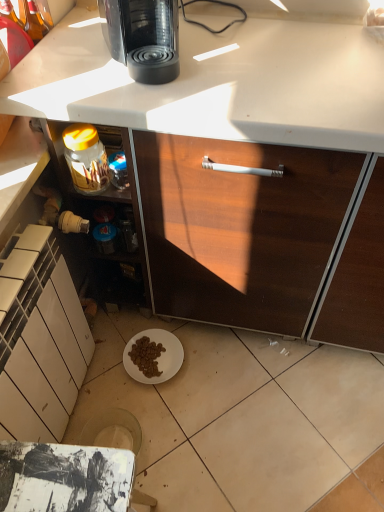
Measure the distance between white matte cabinet at lower left and camera.

white matte cabinet at lower left is 34.69 inches away from camera.

Locate an element on the screen. This screenshot has height=512, width=384. translucent glass jar at lower left is located at coordinates (91, 162).

I want to click on black glossy coffee maker at upper center, so tap(143, 37).

From a real-world perspective, is white matte cabinet at lower left positioned above or below translucent glass jar at lower left?

Clearly, from a real-world perspective, white matte cabinet at lower left is below translucent glass jar at lower left.

Which point is more forward, [39,390] or [49,122]?

The point [49,122] is more forward.

The height and width of the screenshot is (512, 384). Find the location of `shelf that is above the white matte cabinet at lower left (from a real-world perspective)`. shelf that is above the white matte cabinet at lower left (from a real-world perspective) is located at coordinates (91, 162).

From the image's perspective, is white matte cabinet at lower left over translucent glass jar at lower left?

Actually, white matte cabinet at lower left appears below translucent glass jar at lower left in the image.

Considering the positions of point (105, 190) and point (141, 60), is point (105, 190) closer or farther from the camera than point (141, 60)?

Point (105, 190).

Is translucent glass jar at lower left shorter than black glossy coffee maker at upper center?

Incorrect, the height of translucent glass jar at lower left does not fall short of that of black glossy coffee maker at upper center.

Measure the distance from translucent glass jar at lower left to black glossy coffee maker at upper center.

A: The distance of translucent glass jar at lower left from black glossy coffee maker at upper center is 23.33 centimeters.

Which of these two, translucent glass jar at lower left or black glossy coffee maker at upper center, is bigger?

black glossy coffee maker at upper center is bigger.

Between translucent glass jar at lower left and white matte cabinet at lower left, which one has smaller size?

With smaller size is translucent glass jar at lower left.

From the image's perspective, would you say translucent glass jar at lower left is shown under white matte cabinet at lower left?

Actually, translucent glass jar at lower left appears above white matte cabinet at lower left in the image.

Is translucent glass jar at lower left oriented away from white matte cabinet at lower left?

No, white matte cabinet at lower left is not at the back of translucent glass jar at lower left.

Who is shorter, white matte cabinet at lower left or black glossy coffee maker at upper center?

black glossy coffee maker at upper center.

Is white matte cabinet at lower left placed right next to black glossy coffee maker at upper center?

They are not placed beside each other.

Is white matte cabinet at lower left positioned before black glossy coffee maker at upper center?

Yes, it is in front of black glossy coffee maker at upper center.

Would you say white matte cabinet at lower left is outside black glossy coffee maker at upper center?

white matte cabinet at lower left lies outside black glossy coffee maker at upper center's area.

Is point (99, 8) less distant than point (73, 347)?

Yes, point (99, 8) is in front of point (73, 347).

Are black glossy coffee maker at upper center and white matte cabinet at lower left far apart?

Actually, black glossy coffee maker at upper center and white matte cabinet at lower left are a little close together.

Is black glossy coffee maker at upper center bigger or smaller than white matte cabinet at lower left?

black glossy coffee maker at upper center is smaller than white matte cabinet at lower left.

From the image's perspective, does black glossy coffee maker at upper center appear higher than white matte cabinet at lower left?

Yes, from the image's perspective, black glossy coffee maker at upper center is above white matte cabinet at lower left.

From the image's perspective, is black glossy coffee maker at upper center above or below translucent glass jar at lower left?

Based on their image positions, black glossy coffee maker at upper center is located above translucent glass jar at lower left.

Identify the location of coffee maker lying on the right of translucent glass jar at lower left. This screenshot has width=384, height=512. (x=143, y=37).

Measure the distance between black glossy coffee maker at upper center and translucent glass jar at lower left.

They are 23.33 centimeters apart.

Between black glossy coffee maker at upper center and translucent glass jar at lower left, which one appears on the right side from the viewer's perspective?

black glossy coffee maker at upper center.

Image resolution: width=384 pixels, height=512 pixels. In order to click on shelf lying on the right of white matte cabinet at lower left in this screenshot , I will do `click(91, 162)`.

Identify the location of coffee maker in front of the translucent glass jar at lower left. Image resolution: width=384 pixels, height=512 pixels. (143, 37).

Estimate the real-world distances between objects in this image. Which object is further from translucent glass jar at lower left, white matte cabinet at lower left or black glossy coffee maker at upper center?

Based on the image, white matte cabinet at lower left appears to be further to translucent glass jar at lower left.

Based on their spatial positions, is black glossy coffee maker at upper center or white matte cabinet at lower left further from translucent glass jar at lower left?

white matte cabinet at lower left is positioned further to the anchor translucent glass jar at lower left.

Which object lies nearer to the anchor point white matte cabinet at lower left, translucent glass jar at lower left or black glossy coffee maker at upper center?

translucent glass jar at lower left is closer to white matte cabinet at lower left.

Which object lies further to the anchor point black glossy coffee maker at upper center, translucent glass jar at lower left or white matte cabinet at lower left?

The object further to black glossy coffee maker at upper center is white matte cabinet at lower left.

From the picture: When comparing their distances from black glossy coffee maker at upper center, does white matte cabinet at lower left or translucent glass jar at lower left seem further?

Among the two, white matte cabinet at lower left is located further to black glossy coffee maker at upper center.

Estimate the real-world distances between objects in this image. Which object is further from white matte cabinet at lower left, black glossy coffee maker at upper center or translucent glass jar at lower left?

Based on the image, black glossy coffee maker at upper center appears to be further to white matte cabinet at lower left.

The height and width of the screenshot is (512, 384). I want to click on shelf between black glossy coffee maker at upper center and white matte cabinet at lower left from top to bottom, so click(x=91, y=162).